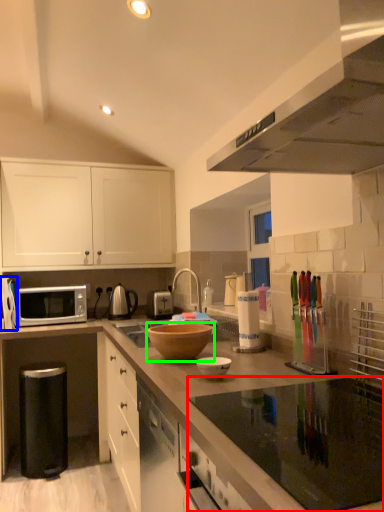
Question: Estimate the real-world distances between objects in this image. Which object is closer to gas stove (highlighted by a red box), appliance (highlighted by a blue box) or mixing bowl (highlighted by a green box)?

Choices:
 (A) appliance
 (B) mixing bowl

Answer: (B)